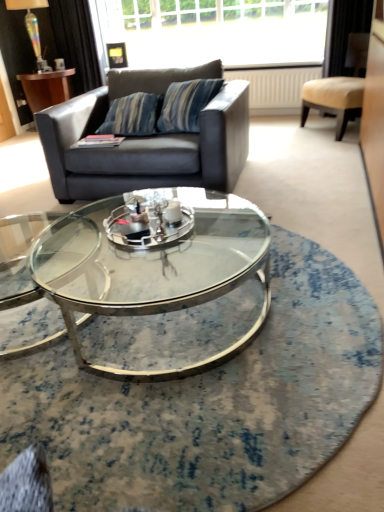
Question: From a real-world perspective, is black velvet curtain at upper left over beige leather chair at upper right?

Choices:
 (A) no
 (B) yes

Answer: (B)

Question: Is black velvet curtain at upper left further to camera compared to beige leather chair at upper right?

Choices:
 (A) yes
 (B) no

Answer: (A)

Question: Does black velvet curtain at upper left have a greater width compared to beige leather chair at upper right?

Choices:
 (A) yes
 (B) no

Answer: (B)

Question: Is beige leather chair at upper right inside black velvet curtain at upper left?

Choices:
 (A) no
 (B) yes

Answer: (A)

Question: Is black velvet curtain at upper left smaller than beige leather chair at upper right?

Choices:
 (A) yes
 (B) no

Answer: (A)

Question: From a real-world perspective, relative to clear glass coffee table at center, is dark gray fabric couch at upper left vertically above or below?

Choices:
 (A) below
 (B) above

Answer: (B)

Question: Is point (188, 169) positioned closer to the camera than point (244, 263)?

Choices:
 (A) farther
 (B) closer

Answer: (A)

Question: Considering their positions, is dark gray fabric couch at upper left located in front of or behind clear glass coffee table at center?

Choices:
 (A) front
 (B) behind

Answer: (B)

Question: Considering the positions of dark gray fabric couch at upper left and clear glass coffee table at center in the image, is dark gray fabric couch at upper left taller or shorter than clear glass coffee table at center?

Choices:
 (A) short
 (B) tall

Answer: (B)

Question: From the image's perspective, is iridescent glass lamp at upper left located above or below clear glass coffee table at center?

Choices:
 (A) above
 (B) below

Answer: (A)

Question: Is iridescent glass lamp at upper left inside the boundaries of clear glass coffee table at center, or outside?

Choices:
 (A) outside
 (B) inside

Answer: (A)

Question: In the image, is iridescent glass lamp at upper left positioned in front of or behind clear glass coffee table at center?

Choices:
 (A) front
 (B) behind

Answer: (B)

Question: Based on their sizes in the image, would you say iridescent glass lamp at upper left is bigger or smaller than clear glass coffee table at center?

Choices:
 (A) small
 (B) big

Answer: (A)

Question: Based on their sizes in the image, would you say clear glass coffee table at center is bigger or smaller than black velvet curtain at upper left?

Choices:
 (A) small
 (B) big

Answer: (B)

Question: From the image's perspective, relative to black velvet curtain at upper left, is clear glass coffee table at center above or below?

Choices:
 (A) above
 (B) below

Answer: (B)